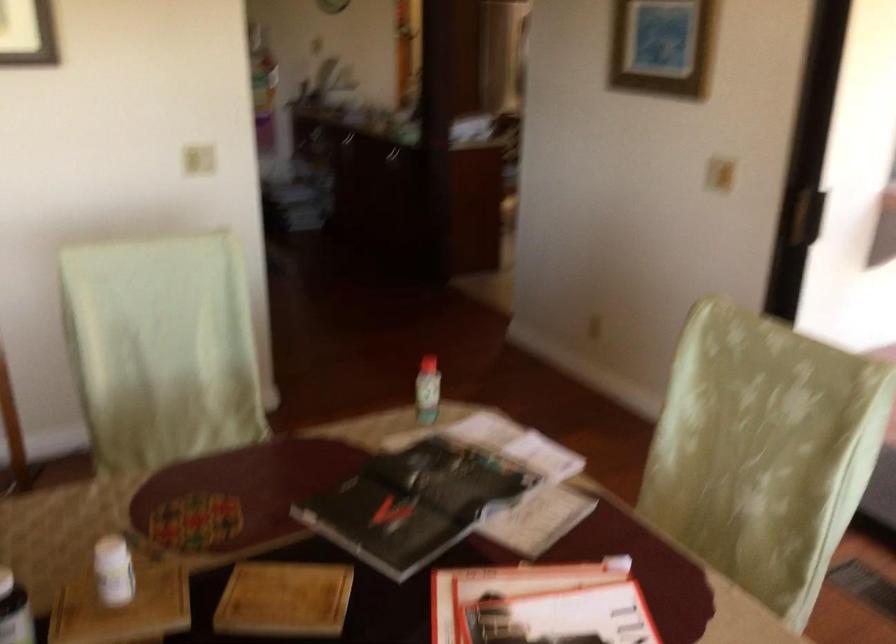
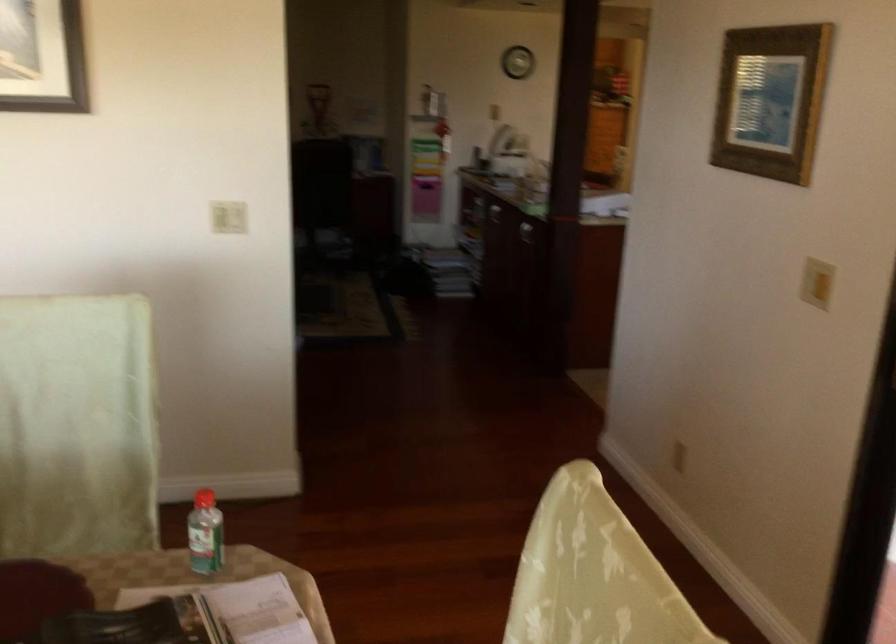
Find the pixel in the second image that matches (470,436) in the first image.

(238, 609)